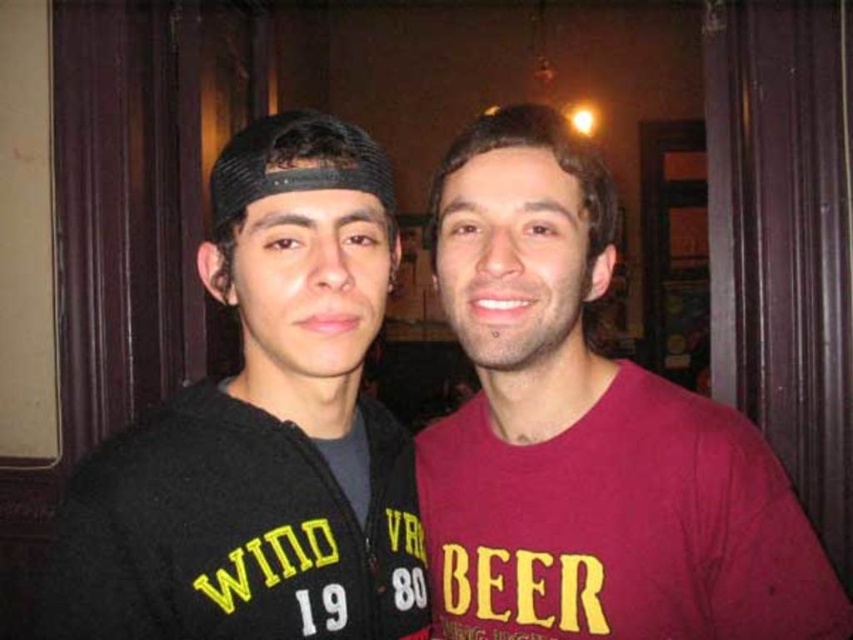
Can you confirm if maroon cotton t-shirt at center is thinner than black fleece jacket at left?

Incorrect, maroon cotton t-shirt at center's width is not less than black fleece jacket at left's.

Looking at this image, which is more to the right, maroon cotton t-shirt at center or black fleece jacket at left?

From the viewer's perspective, maroon cotton t-shirt at center appears more on the right side.

What do you see at coordinates (587, 435) in the screenshot? Image resolution: width=853 pixels, height=640 pixels. I see `maroon cotton t-shirt at center` at bounding box center [587, 435].

Where is `maroon cotton t-shirt at center`? maroon cotton t-shirt at center is located at coordinates (587, 435).

Who is shorter, maroon cotton t-shirt at center or black knitted cap at center?

With less height is black knitted cap at center.

Does point (476, 326) come closer to viewer compared to point (308, 134)?

No, (476, 326) is further to viewer.

This screenshot has height=640, width=853. What do you see at coordinates (587, 435) in the screenshot?
I see `maroon cotton t-shirt at center` at bounding box center [587, 435].

Locate an element on the screen. Image resolution: width=853 pixels, height=640 pixels. maroon cotton t-shirt at center is located at coordinates (587, 435).

Who is more distant from viewer, [228,230] or [222,218]?

The point [228,230] is behind.

Where is `black fleece jacket at left`? black fleece jacket at left is located at coordinates (262, 429).